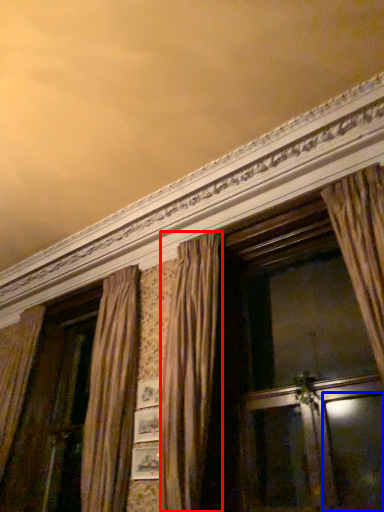
Question: Which of the following is the farthest to the observer, curtain (highlighted by a red box) or screen door (highlighted by a blue box)?

Choices:
 (A) curtain
 (B) screen door

Answer: (A)